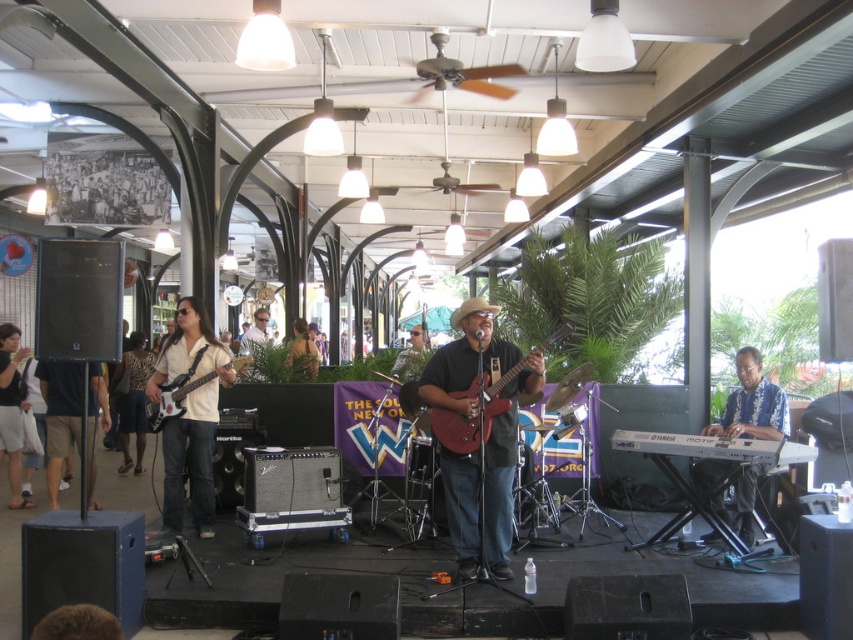
Who is more forward, (171, 342) or (164, 403)?

Point (164, 403) is in front.

This screenshot has width=853, height=640. Identify the location of matte white shirt at left. (190, 417).

Find the location of a particular element. matte white shirt at left is located at coordinates (190, 417).

Locate an element on the screen. This screenshot has height=640, width=853. matte white shirt at left is located at coordinates (190, 417).

How much distance is there between hawaiian shirt at right and matte black electric guitar at left?

3.64 meters

Based on the photo, can you confirm if hawaiian shirt at right is shorter than matte black electric guitar at left?

No.

Does point (744, 387) come farther from viewer compared to point (148, 428)?

No, it is in front of (148, 428).

Locate an element on the screen. This screenshot has width=853, height=640. hawaiian shirt at right is located at coordinates [x=752, y=403].

Between point (723, 429) and point (120, 376), which one is positioned behind?

Positioned behind is point (120, 376).

Does hawaiian shirt at right have a lesser height compared to leather jacket at left?

Yes, hawaiian shirt at right is shorter than leather jacket at left.

Locate an element on the screen. hawaiian shirt at right is located at coordinates (752, 403).

Where is `hawaiian shirt at right`? hawaiian shirt at right is located at coordinates (752, 403).